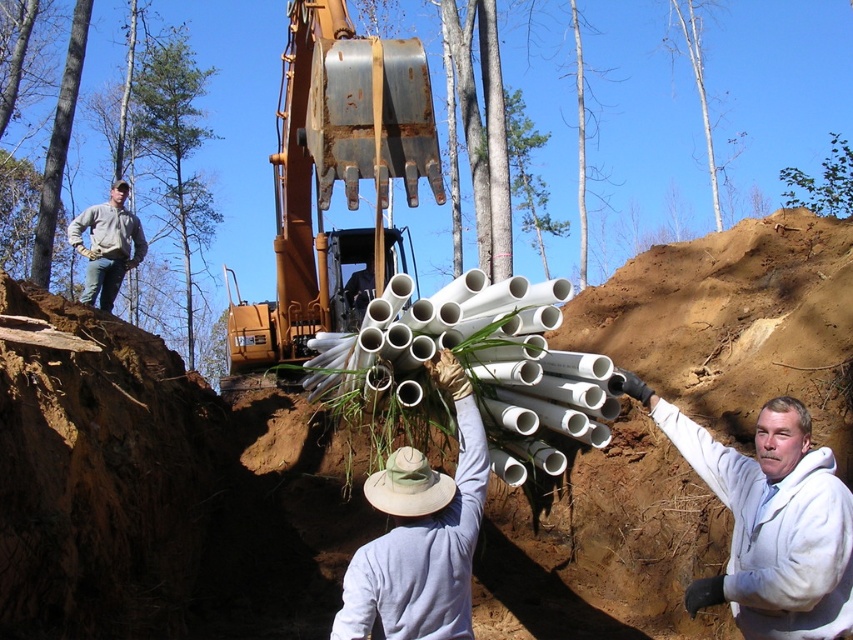
Who is more distant from viewer, (x=399, y=109) or (x=810, y=461)?

The point (x=399, y=109) is behind.

Is point (334, 115) closer to camera compared to point (619, 378)?

That is False.

From the picture: Who is more distant from viewer, (x=339, y=92) or (x=717, y=579)?

Point (x=339, y=92)

In order to click on rusty metal excavator at center in this screenshot , I will do `click(334, 168)`.

Describe the element at coordinates (770, 522) in the screenshot. I see `white fleece jacket at right` at that location.

Between white fleece jacket at right and white matte pipe at center, which one appears on the right side from the viewer's perspective?

white fleece jacket at right is more to the right.

I want to click on white fleece jacket at right, so click(770, 522).

Is point (380, 156) more distant than point (457, 484)?

Yes, point (380, 156) is farther from viewer.

Is point (254, 332) positioned before point (434, 605)?

No, it is not.

This screenshot has width=853, height=640. In order to click on rusty metal excavator at center in this screenshot , I will do `click(334, 168)`.